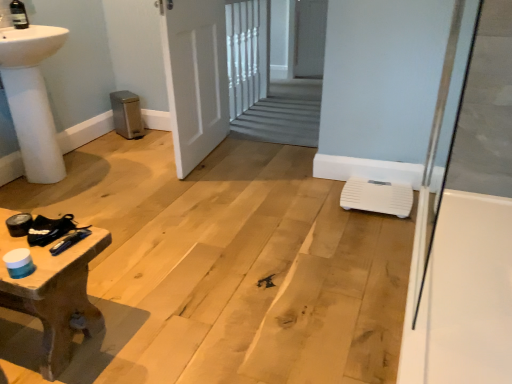
Question: Could you tell me if white glossy bath at right is facing white plastic scale at lower right?

Choices:
 (A) yes
 (B) no

Answer: (B)

Question: From a real-world perspective, is white glossy bath at right over white plastic scale at lower right?

Choices:
 (A) yes
 (B) no

Answer: (A)

Question: Would you consider white glossy bath at right to be distant from white plastic scale at lower right?

Choices:
 (A) yes
 (B) no

Answer: (B)

Question: Is white glossy bath at right oriented away from white plastic scale at lower right?

Choices:
 (A) yes
 (B) no

Answer: (A)

Question: Is white glossy bath at right wider than white plastic scale at lower right?

Choices:
 (A) yes
 (B) no

Answer: (B)

Question: Is white glossy bath at right located outside white plastic scale at lower right?

Choices:
 (A) yes
 (B) no

Answer: (A)

Question: Is wooden textured table at lower left positioned with its back to white plastic scale at lower right?

Choices:
 (A) yes
 (B) no

Answer: (B)

Question: Is wooden textured table at lower left in contact with white plastic scale at lower right?

Choices:
 (A) no
 (B) yes

Answer: (A)

Question: Does wooden textured table at lower left have a smaller size compared to white plastic scale at lower right?

Choices:
 (A) yes
 (B) no

Answer: (B)

Question: Does wooden textured table at lower left have a larger size compared to white plastic scale at lower right?

Choices:
 (A) yes
 (B) no

Answer: (A)

Question: Does wooden textured table at lower left appear on the left side of white plastic scale at lower right?

Choices:
 (A) no
 (B) yes

Answer: (B)

Question: Are wooden textured table at lower left and white plastic scale at lower right located far from each other?

Choices:
 (A) yes
 (B) no

Answer: (A)

Question: Does white glossy bath at right come in front of metallic blue screwdriver at lower left?

Choices:
 (A) yes
 (B) no

Answer: (A)